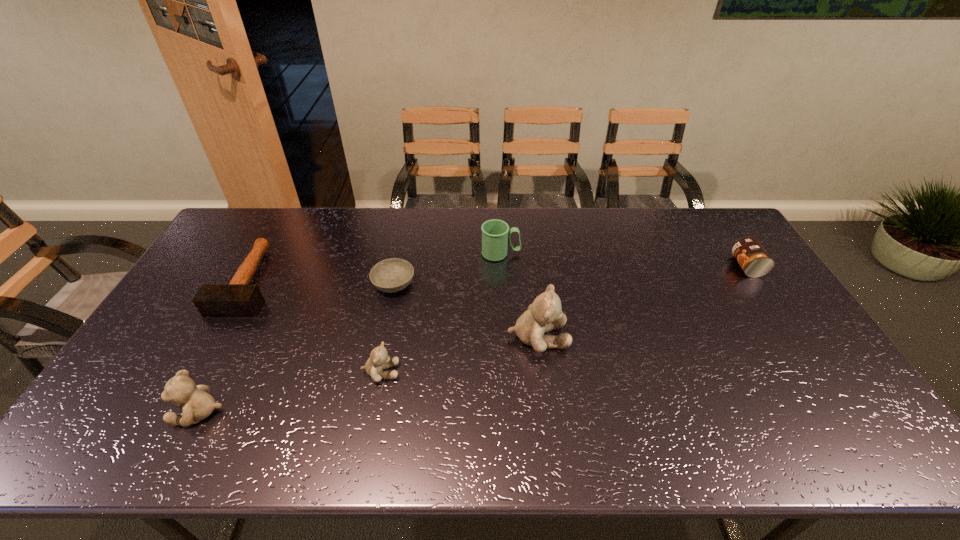
All teddy bears are currently evenly spaced. To continue this pattern, where would you add another teddy bear on the right? Please point out a vacant spot. Please provide its 2D coordinates. Your answer should be formatted as a tuple, i.e. [(x, y)], where the tuple contains the x and y coordinates of a point satisfying the conditions above.

[(675, 307)]